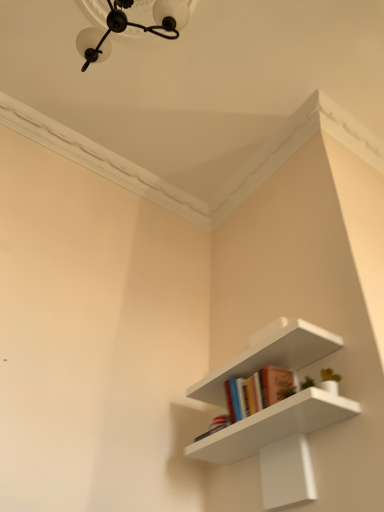
Question: Should I look upward or downward to see white matte shelf at center?

Choices:
 (A) down
 (B) up

Answer: (A)